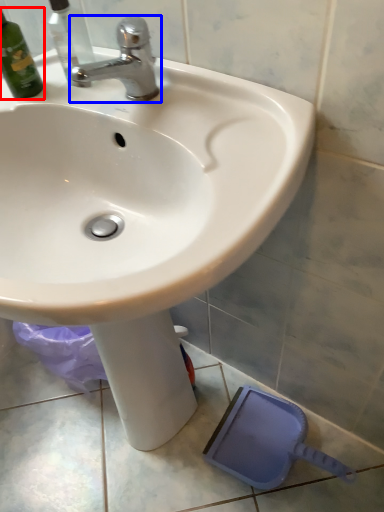
Question: Which object is further to the camera taking this photo, bottle (highlighted by a red box) or tap (highlighted by a blue box)?

Choices:
 (A) bottle
 (B) tap

Answer: (A)